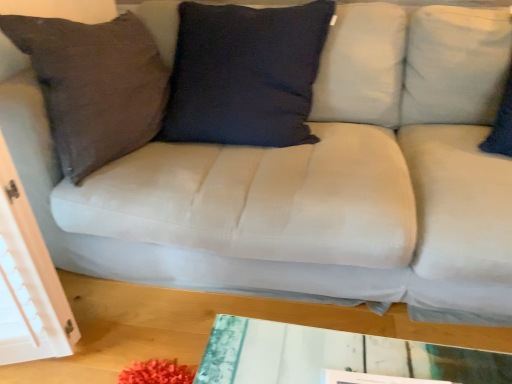
Question: Should I look upward or downward to see suede-like brown pillow at left?

Choices:
 (A) up
 (B) down

Answer: (A)